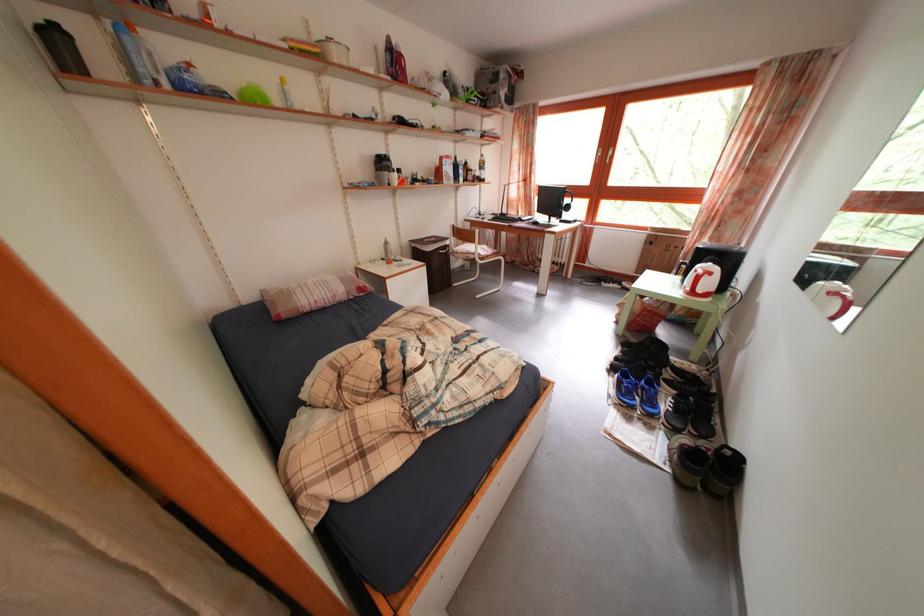
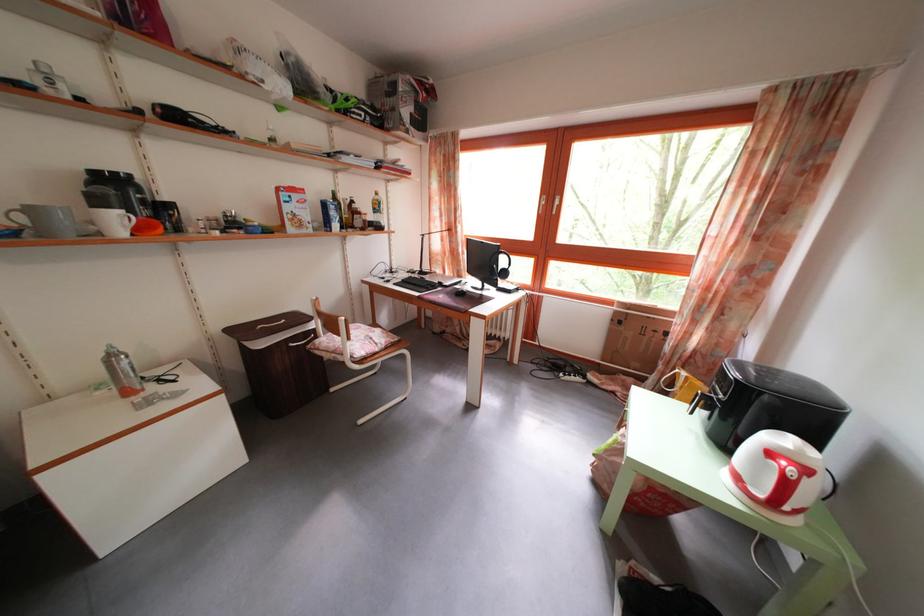
In a continuous first-person perspective shot, in which direction is the camera moving?

The cameraman moved toward right, forward.